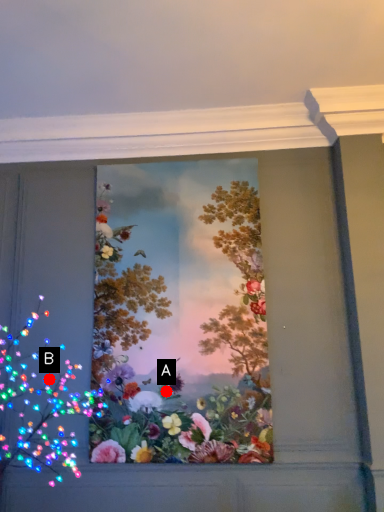
Question: Two points are circled on the image, labeled by A and B beside each circle. Which point is farther from the camera taking this photo?

Choices:
 (A) A is further
 (B) B is further

Answer: (B)